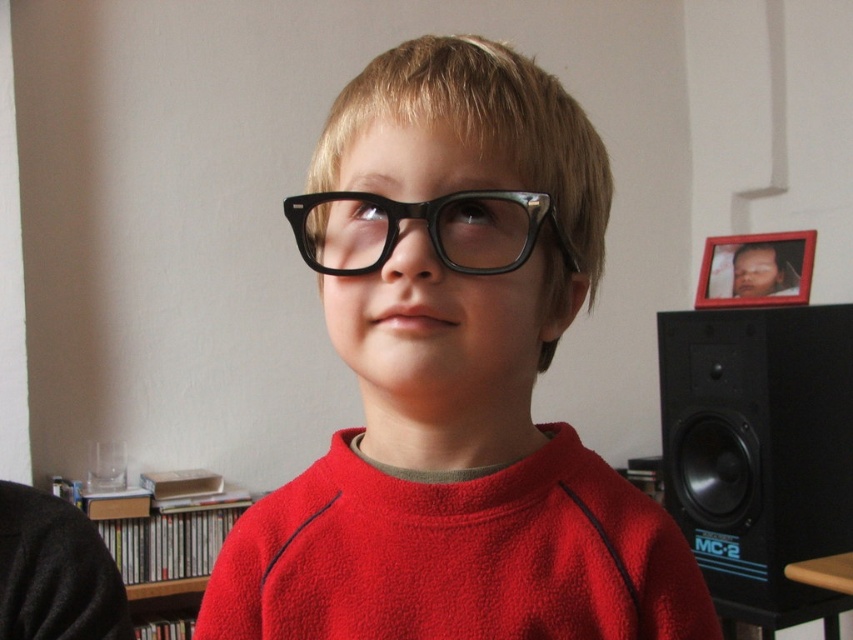
Question: Estimate the real-world distances between objects in this image. Which object is farther from the matte black glasses at center?

Choices:
 (A) black acetate glasses at center
 (B) wooden bookshelf at lower left

Answer: (B)

Question: Is the position of matte black glasses at center less distant than that of wooden bookshelf at lower left?

Choices:
 (A) yes
 (B) no

Answer: (A)

Question: Which object appears farthest from the camera in this image?

Choices:
 (A) matte black glasses at center
 (B) black plastic speaker at right
 (C) wooden bookshelf at lower left
 (D) black acetate glasses at center

Answer: (C)

Question: Can you confirm if matte black glasses at center is wider than black plastic speaker at right?

Choices:
 (A) yes
 (B) no

Answer: (B)

Question: Which object is positioned farthest from the wooden bookshelf at lower left?

Choices:
 (A) matte black glasses at center
 (B) black acetate glasses at center

Answer: (B)

Question: In this image, where is black plastic speaker at right located relative to black acetate glasses at center?

Choices:
 (A) left
 (B) right

Answer: (B)